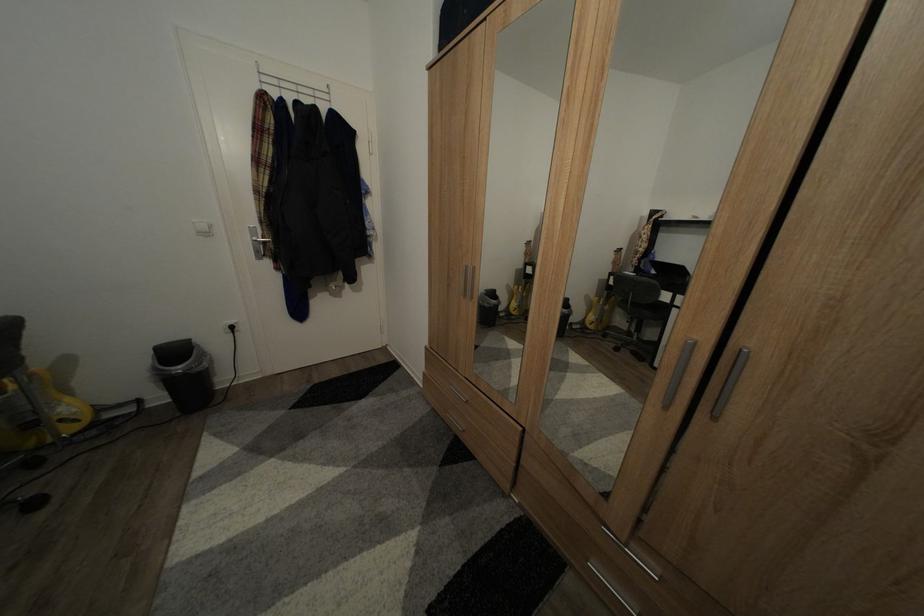
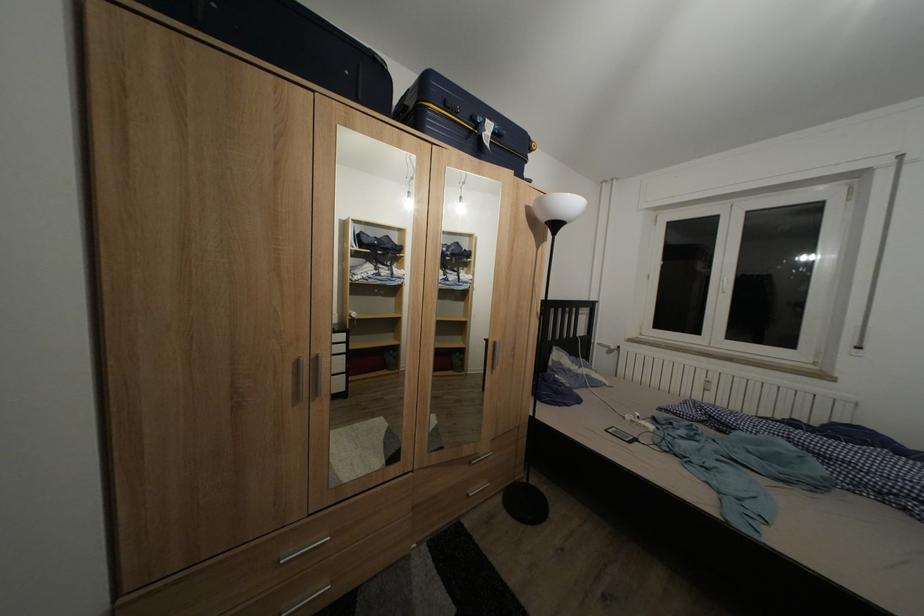
Question: Based on the continuous images, in which direction is the camera rotating? Reply with the corresponding letter.

Choices:
 (A) Left
 (B) Right
 (C) Up
 (D) Down

Answer: (B)